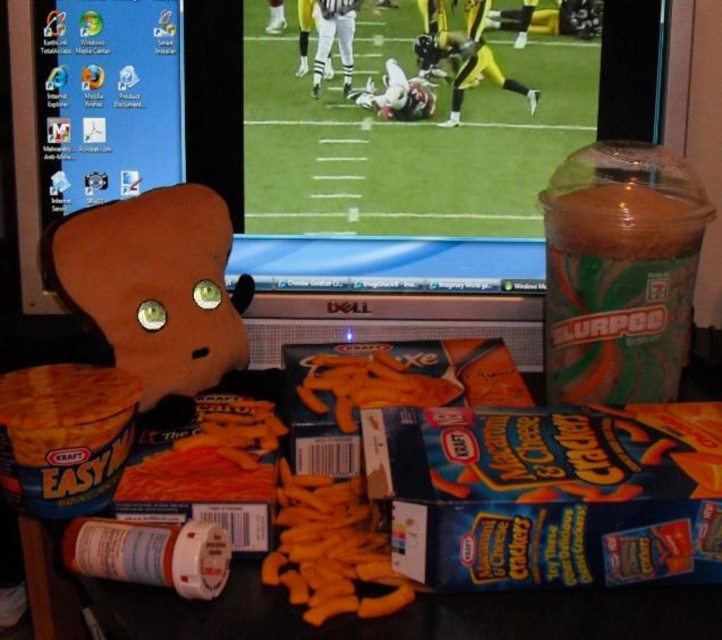
Question: Which of the following is the farthest from the observer?

Choices:
 (A) yellow matte macaroni at center
 (B) orange matte macaroni at center

Answer: (B)

Question: Is yellow matte macaroni at center below orange matte macaroni at center?

Choices:
 (A) no
 (B) yes

Answer: (B)

Question: Among these points, which one is nearest to the camera?

Choices:
 (A) (277, 488)
 (B) (414, 397)
 (C) (73, 292)

Answer: (A)

Question: Does brown plush toy at left lie in front of yellow matte macaroni at center?

Choices:
 (A) no
 (B) yes

Answer: (A)

Question: Which point is closer to the camera taking this photo?

Choices:
 (A) (232, 298)
 (B) (357, 557)
 (C) (352, 385)

Answer: (B)

Question: Is yellow matte macaroni at center above orange matte macaroni at center?

Choices:
 (A) yes
 (B) no

Answer: (B)